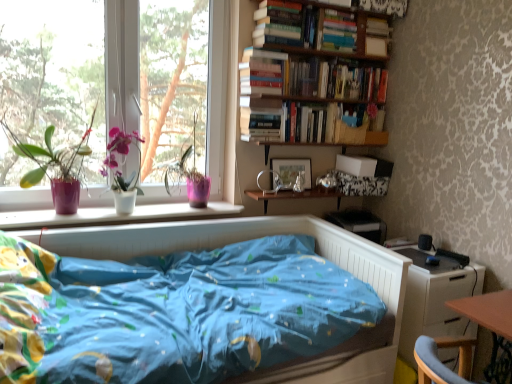
Question: Does transparent glass window at left, which ranks as the 2th window screen in right-to-left order, come behind hardcover books at upper center, the 1th book ordered from the bottom?

Choices:
 (A) yes
 (B) no

Answer: (B)

Question: Does transparent glass window at left, marked as the first window screen in a left-to-right arrangement, have a smaller size compared to hardcover books at upper center, arranged as the third book when viewed from the top?

Choices:
 (A) no
 (B) yes

Answer: (A)

Question: Considering the relative sizes of transparent glass window at left, marked as the first window screen in a left-to-right arrangement, and hardcover books at upper center, the 1th book ordered from the bottom, in the image provided, is transparent glass window at left, marked as the first window screen in a left-to-right arrangement, shorter than hardcover books at upper center, the 1th book ordered from the bottom,?

Choices:
 (A) yes
 (B) no

Answer: (B)

Question: From the image's perspective, is transparent glass window at left, marked as the first window screen in a left-to-right arrangement, beneath hardcover books at upper center, arranged as the third book when viewed from the top?

Choices:
 (A) yes
 (B) no

Answer: (A)

Question: Is transparent glass window at left, which ranks as the 2th window screen in right-to-left order, not inside hardcover books at upper center, arranged as the third book when viewed from the top?

Choices:
 (A) yes
 (B) no

Answer: (A)

Question: Is transparent glass window at left, which ranks as the 2th window screen in right-to-left order, oriented towards hardcover books at upper center, the 1th book ordered from the bottom?

Choices:
 (A) no
 (B) yes

Answer: (A)

Question: Is blue fabric bed at center surrounded by matte wooden picture frame at center?

Choices:
 (A) no
 (B) yes

Answer: (A)

Question: Is matte wooden picture frame at center not inside blue fabric bed at center?

Choices:
 (A) yes
 (B) no

Answer: (A)

Question: From the image's perspective, is matte wooden picture frame at center on blue fabric bed at center?

Choices:
 (A) yes
 (B) no

Answer: (A)

Question: From the image's perspective, would you say matte wooden picture frame at center is shown under blue fabric bed at center?

Choices:
 (A) no
 (B) yes

Answer: (A)

Question: Can you confirm if matte wooden picture frame at center is wider than blue fabric bed at center?

Choices:
 (A) yes
 (B) no

Answer: (B)

Question: Is matte wooden picture frame at center at the left side of blue fabric bed at center?

Choices:
 (A) no
 (B) yes

Answer: (A)

Question: Can you confirm if transparent glass window at upper left is bigger than hardcover book at upper right, which is the 2th book in bottom-to-top order?

Choices:
 (A) no
 (B) yes

Answer: (B)